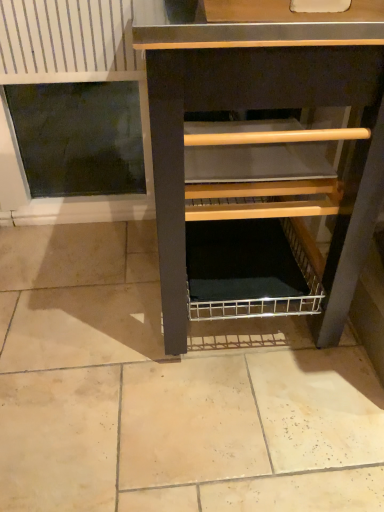
You are a GUI agent. You are given a task and a screenshot of the screen. Output one action in this format:
    pyautogui.click(x=<x>, y=<y>)
    Task: Click on the free space that is to the left of metallic silver shelf at center
    The width and height of the screenshot is (384, 512).
    Given the screenshot: What is the action you would take?
    pyautogui.click(x=81, y=291)